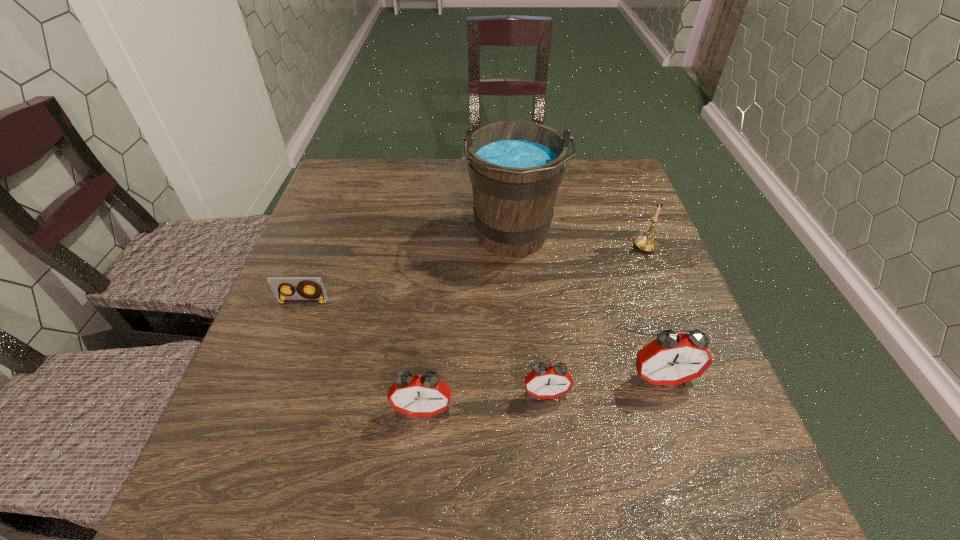
I want to click on free space located 0.080m on the clock face of the tallest alarm clock, so click(680, 433).

Locate an element on the screen. The height and width of the screenshot is (540, 960). free space located 0.110m with a handle on the side of the wine bucket is located at coordinates (517, 309).

This screenshot has height=540, width=960. I want to click on vacant space positioned on the handle side of the candle holder, so click(673, 316).

You are a GUI agent. You are given a task and a screenshot of the screen. Output one action in this format:
    pyautogui.click(x=<x>, y=<y>)
    Task: Click on the free space located 0.300m at the front of the videotape with visible reels
    
    Given the screenshot: What is the action you would take?
    pyautogui.click(x=252, y=436)

Find the location of `object present at the left edge`. object present at the left edge is located at coordinates (316, 293).

The width and height of the screenshot is (960, 540). I want to click on alarm clock that is at the right edge, so click(x=671, y=359).

What are the coordinates of `candle holder that is positioned at the right edge` in the screenshot? It's located at (648, 244).

Where is `free space at the far edge of the desktop`? This screenshot has width=960, height=540. free space at the far edge of the desktop is located at coordinates (459, 182).

Locate an element on the screen. The height and width of the screenshot is (540, 960). vacant area at the near edge is located at coordinates (597, 420).

Locate an element on the screen. Image resolution: width=960 pixels, height=540 pixels. free location at the left edge is located at coordinates (343, 300).